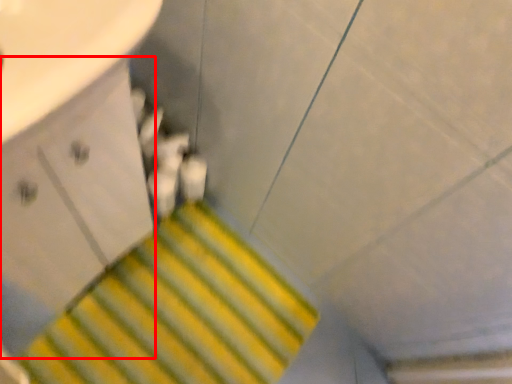
Question: From the image, what is the correct spatial relationship of drawer (annotated by the red box) in relation to stairs?

Choices:
 (A) right
 (B) left

Answer: (B)